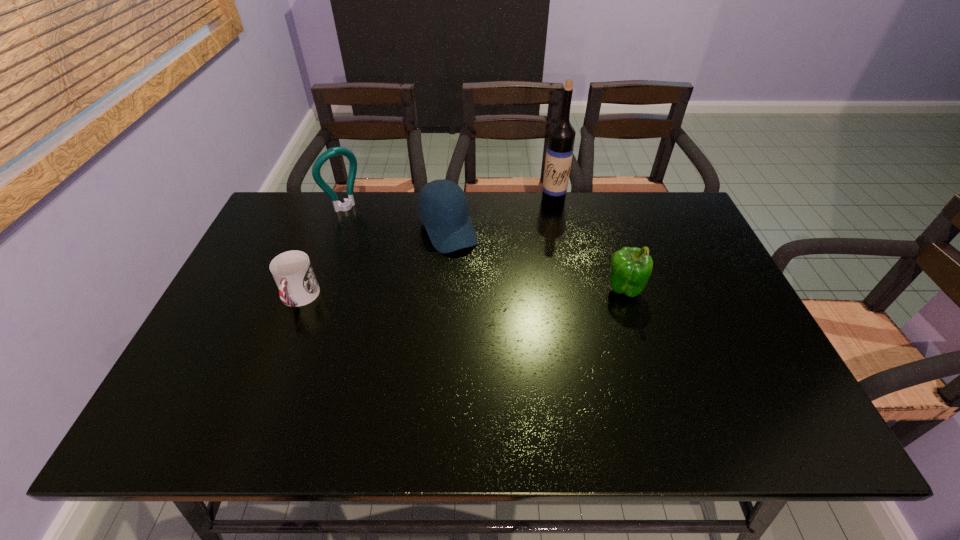
Where is `baseball cap located at the far edge`? baseball cap located at the far edge is located at coordinates (442, 206).

In order to click on bottle opener that is positioned at the far edge in this screenshot , I will do `click(348, 203)`.

This screenshot has height=540, width=960. What are the coordinates of `object present at the left edge` in the screenshot? It's located at (292, 271).

Where is `free space at the far edge`? This screenshot has width=960, height=540. free space at the far edge is located at coordinates (508, 226).

At what (x,y) coordinates should I click in order to perform the action: click on vacant area at the near edge. Please return your answer as a coordinate pair (x, y). Looking at the image, I should click on (496, 396).

In the image, there is a desktop. At what (x,y) coordinates should I click in order to perform the action: click on free region at the left edge. Please return your answer as a coordinate pair (x, y). This screenshot has width=960, height=540. Looking at the image, I should click on (200, 355).

This screenshot has width=960, height=540. I want to click on vacant area at the far left corner of the desktop, so click(310, 195).

Where is `free space at the far right corner`? Image resolution: width=960 pixels, height=540 pixels. free space at the far right corner is located at coordinates (673, 233).

The image size is (960, 540). I want to click on free space between the third tallest object and the bottle opener, so click(484, 248).

Where is `vacant area between the bell pepper and the cup`? The image size is (960, 540). vacant area between the bell pepper and the cup is located at coordinates (462, 294).